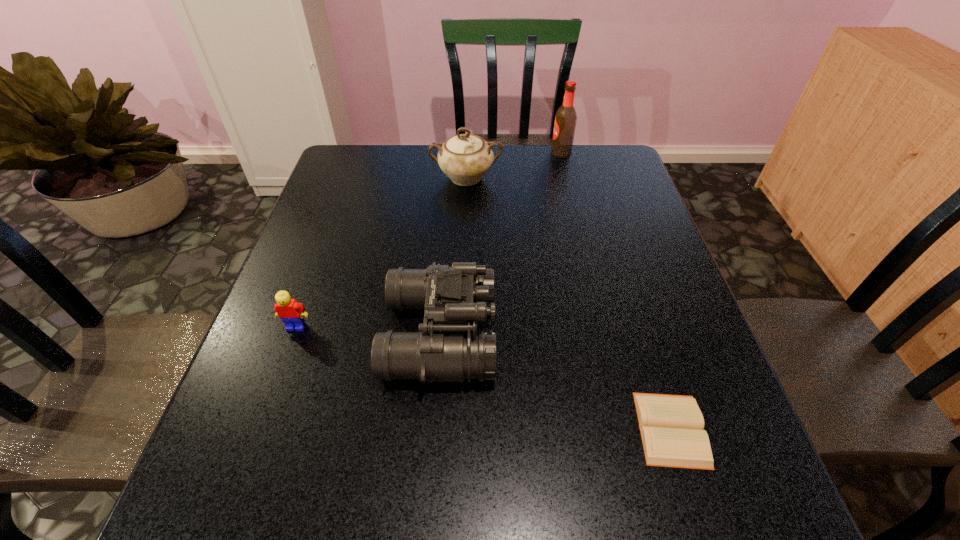
This screenshot has width=960, height=540. I want to click on the farthest object, so click(x=565, y=119).

Find the location of a particular element. beer bottle is located at coordinates (565, 119).

The width and height of the screenshot is (960, 540). What are the coordinates of `chinaware` in the screenshot? It's located at (465, 158).

Image resolution: width=960 pixels, height=540 pixels. Identify the location of binoculars. (453, 297).

Identify the location of Lego. This screenshot has height=540, width=960. (291, 312).

Find the location of a particular element. the leftmost object is located at coordinates (291, 312).

The height and width of the screenshot is (540, 960). I want to click on the shortest object, so click(x=671, y=426).

Identify the location of free space located 0.120m on the right of the tallest object. (608, 153).

Where is `vacant space located 0.180m on the left of the chinaware`? vacant space located 0.180m on the left of the chinaware is located at coordinates (371, 178).

I want to click on vacant space situated 0.120m through the lenses of the binoculars, so click(552, 335).